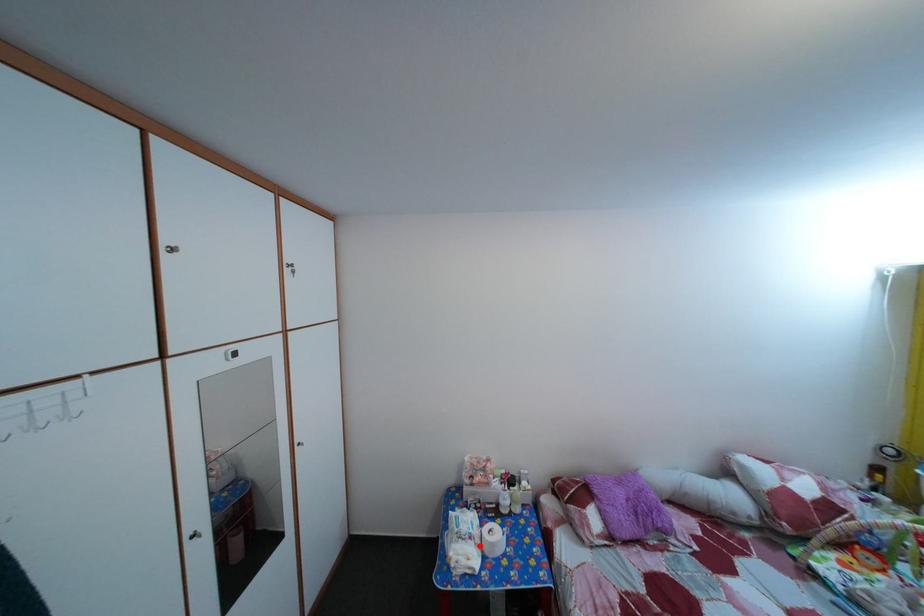
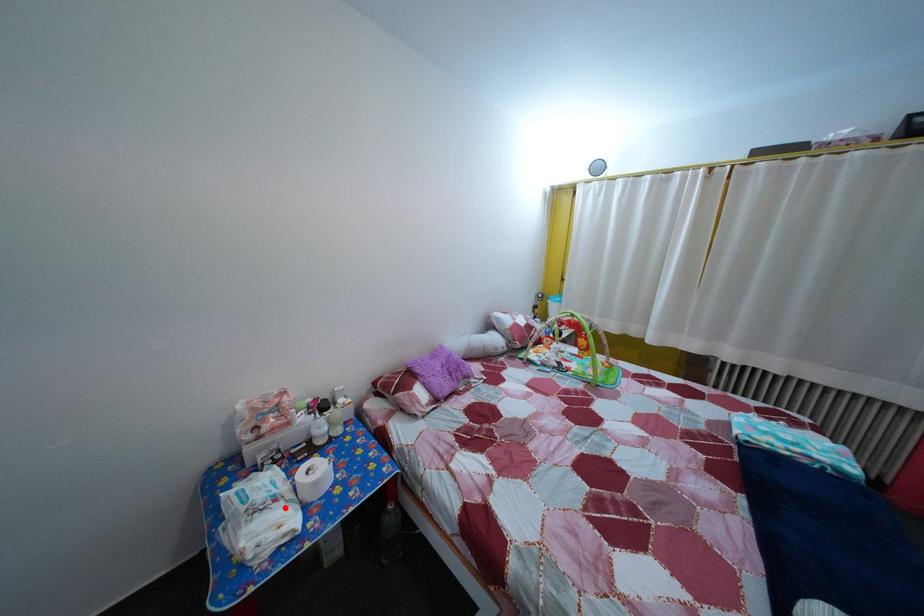
I am providing you with two images of the same scene from different viewpoints. A red point is marked on the first image and another point is marked on the second image. Are the points marked in image1 and image2 representing the same 3D position?

Yes